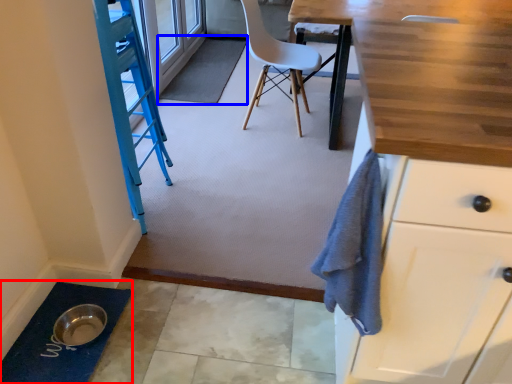
Question: Which object is closer to the camera taking this photo, bath mat (highlighted by a red box) or bath mat (highlighted by a blue box)?

Choices:
 (A) bath mat
 (B) bath mat

Answer: (A)